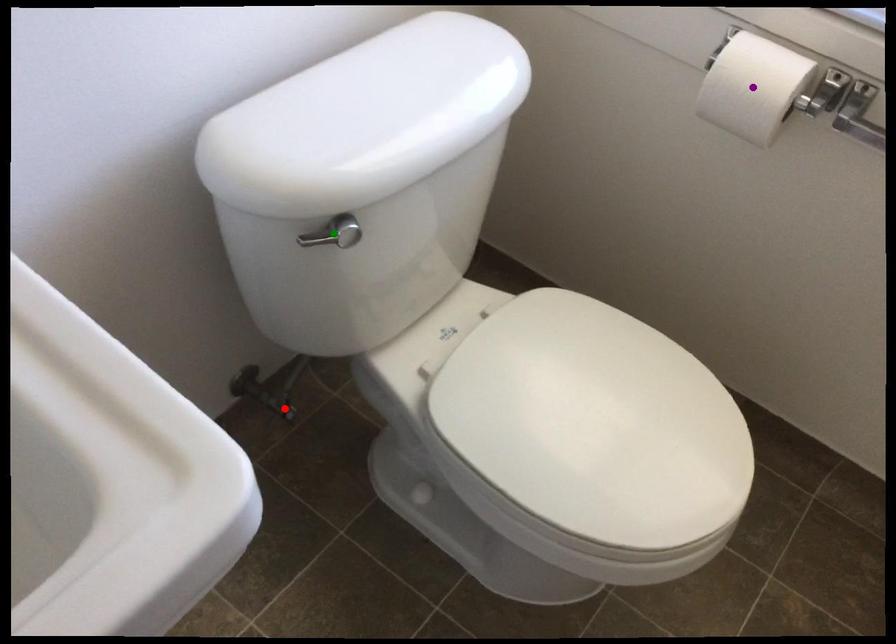
Order these from nearest to farthest:
red point, green point, purple point

green point < purple point < red point